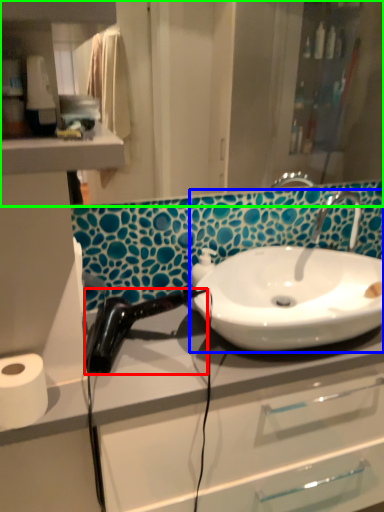
Question: Based on their relative distances, which object is farther from hair drier (highlighted by a red box)? Choose from sink (highlighted by a blue box) and mirror (highlighted by a green box).

Choices:
 (A) sink
 (B) mirror

Answer: (B)